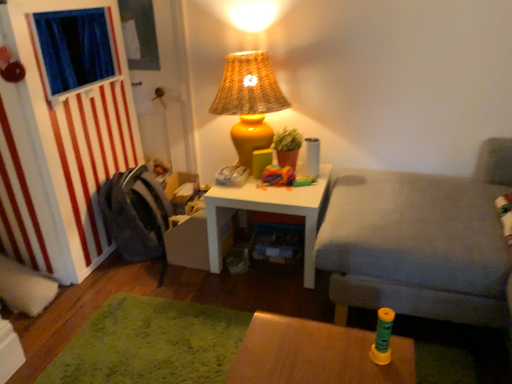
Question: Based on their sizes in the image, would you say white matte table at center, placed as the 2th table when sorted from front to back, is bigger or smaller than gray fabric couch at right?

Choices:
 (A) small
 (B) big

Answer: (A)

Question: Considering the positions of white matte table at center, placed as the 2th table when sorted from front to back, and gray fabric couch at right in the image, is white matte table at center, placed as the 2th table when sorted from front to back, taller or shorter than gray fabric couch at right?

Choices:
 (A) short
 (B) tall

Answer: (A)

Question: Which object is the closest to the yellow wicker lampshade at upper center?

Choices:
 (A) gray fabric swivel chair at left
 (B) gray fabric couch at right
 (C) white matte table at center, placed as the 2th table when sorted from front to back
 (D) blue fabric curtain at left
 (E) wooden table at lower center, the 2th table when ordered from top to bottom

Answer: (C)

Question: Estimate the real-world distances between objects in this image. Which object is closer to the gray fabric couch at right?

Choices:
 (A) blue fabric curtain at left
 (B) gray fabric swivel chair at left
 (C) white matte table at center, which ranks as the 1th table in top-to-bottom order
 (D) wooden table at lower center, the 2th table when ordered from top to bottom
 (E) yellow wicker lampshade at upper center

Answer: (C)